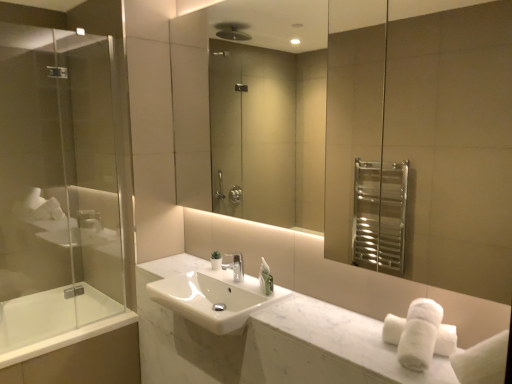
Question: Considering the positions of point (370, 334) and point (239, 278), is point (370, 334) closer or farther from the camera than point (239, 278)?

Choices:
 (A) closer
 (B) farther

Answer: (A)

Question: Is white marble counter at center wider or thinner than silver metallic faucet at center?

Choices:
 (A) thin
 (B) wide

Answer: (B)

Question: Considering the real-world distances, which object is closest to the white glossy sink at center?

Choices:
 (A) white marble counter at center
 (B) silver metallic faucet at center
 (C) white glossy bathtub at lower left
 (D) transparent glass screen door at left

Answer: (A)

Question: Which object is positioned farthest from the white glossy sink at center?

Choices:
 (A) white glossy bathtub at lower left
 (B) white marble counter at center
 (C) silver metallic faucet at center
 (D) transparent glass screen door at left

Answer: (D)